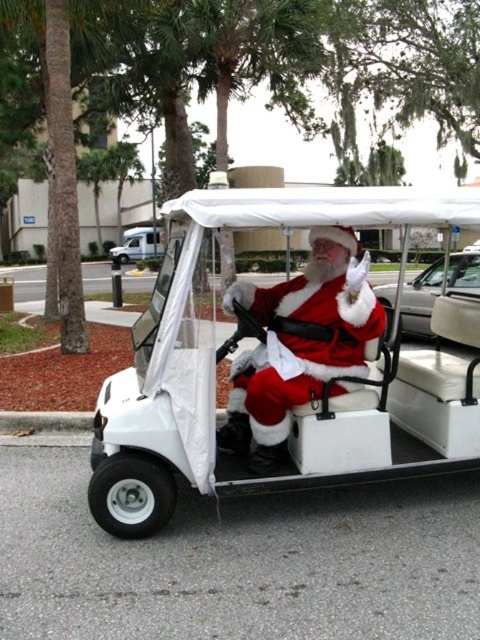
Which of these two, white matte golf cart at center or white glossy van at upper left, stands shorter?

With less height is white matte golf cart at center.

Is white matte golf cart at center behind white glossy van at upper left?

No, it is not.

Is point (409, 392) positioned before point (135, 248)?

Yes, it is in front of point (135, 248).

What are the coordinates of `white matte golf cart at center` in the screenshot? It's located at (278, 362).

Does point (335, 316) lie in front of point (152, 227)?

Yes, point (335, 316) is closer to viewer.

Locate an element on the screen. The height and width of the screenshot is (640, 480). fuzzy red santa at center is located at coordinates (300, 344).

Locate an element on the screen. fuzzy red santa at center is located at coordinates (300, 344).

Where is `fuzzy red santa at center`? The width and height of the screenshot is (480, 640). fuzzy red santa at center is located at coordinates [x=300, y=344].

Can you confirm if fuzzy red santa at center is bigger than white leather car at right?

Actually, fuzzy red santa at center might be smaller than white leather car at right.

Locate an element on the screen. This screenshot has width=480, height=640. fuzzy red santa at center is located at coordinates (300, 344).

Locate an element on the screen. This screenshot has height=640, width=480. fuzzy red santa at center is located at coordinates (300, 344).